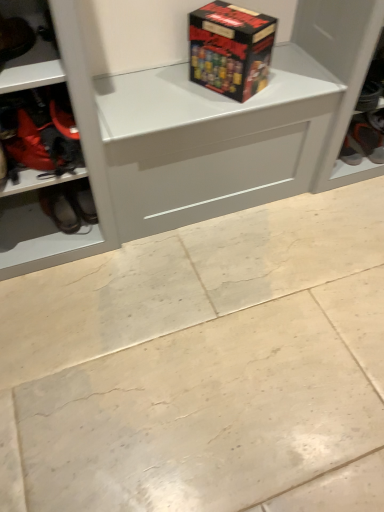
Identify the location of vacant region in front of black leather shoes at lower left, placed as the 2th footwear when sorted from left to right. The width and height of the screenshot is (384, 512). (49, 246).